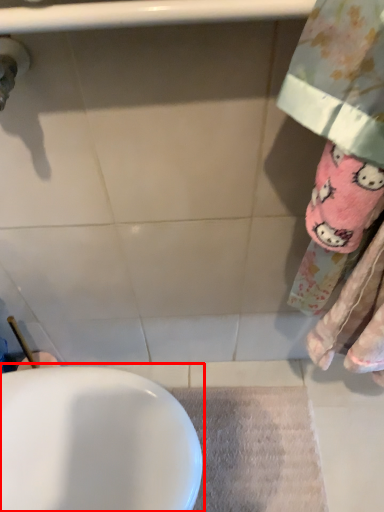
Question: From the image's perspective, where is sink (annotated by the red box) located relative to bath mat?

Choices:
 (A) above
 (B) below

Answer: (A)